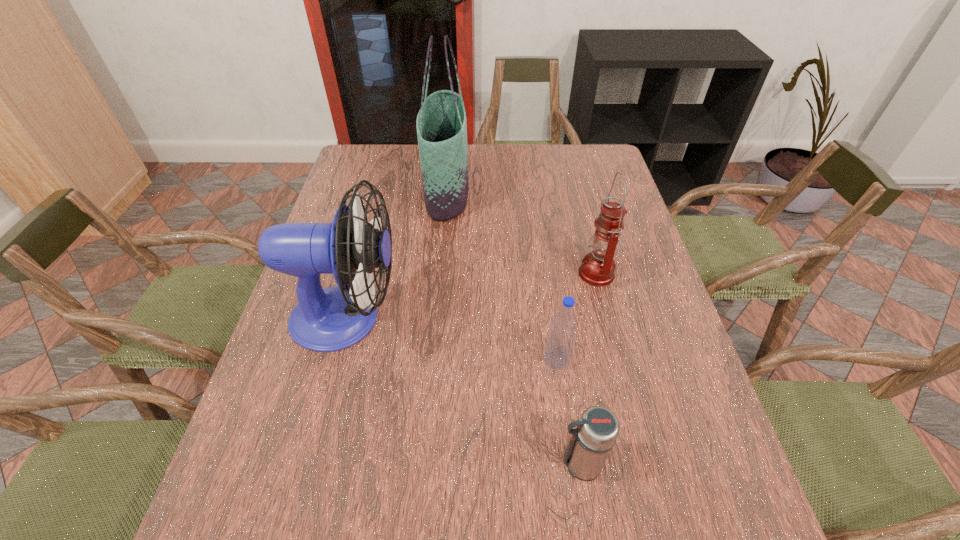
Image resolution: width=960 pixels, height=540 pixels. Find the location of `the farthest object`. the farthest object is located at coordinates [x=441, y=124].

Find the location of a particular element. This screenshot has width=960, height=540. the second object from left to right is located at coordinates (441, 124).

Where is `the leftmost object`? The width and height of the screenshot is (960, 540). the leftmost object is located at coordinates (325, 320).

Find the location of a particular element. the third shortest object is located at coordinates (597, 269).

Image resolution: width=960 pixels, height=540 pixels. Identify the location of the rightmost object. (x=597, y=269).

Identify the location of water bottle. (560, 340).

Where is `the shortest object`? the shortest object is located at coordinates (591, 442).

The height and width of the screenshot is (540, 960). Find the location of `the nearest object`. the nearest object is located at coordinates (591, 442).

Find the location of a particular element. free space located 0.150m on the right of the tallest object is located at coordinates (515, 191).

Identify the location of vacant area situated 0.190m in front of the leftmost object where the airflow is directed. (480, 318).